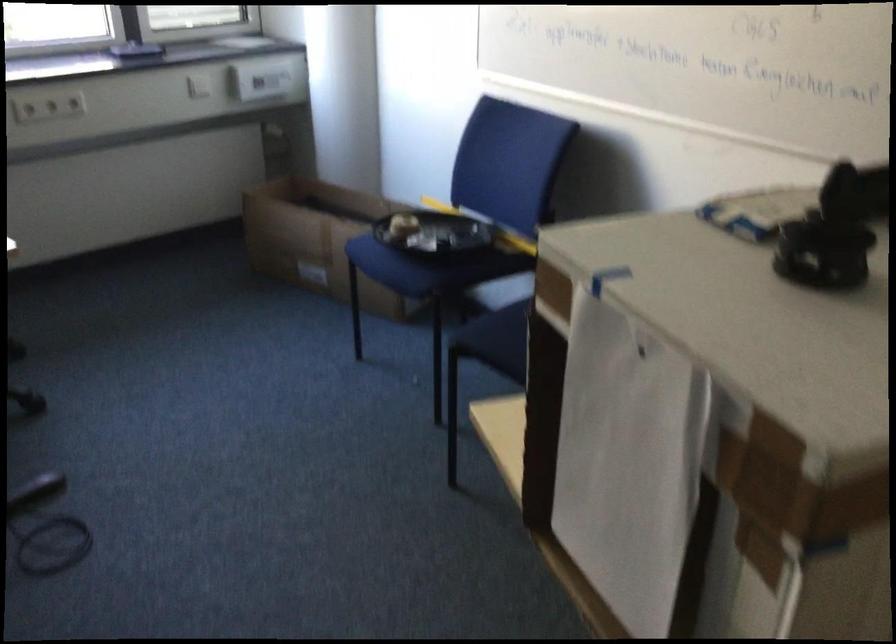
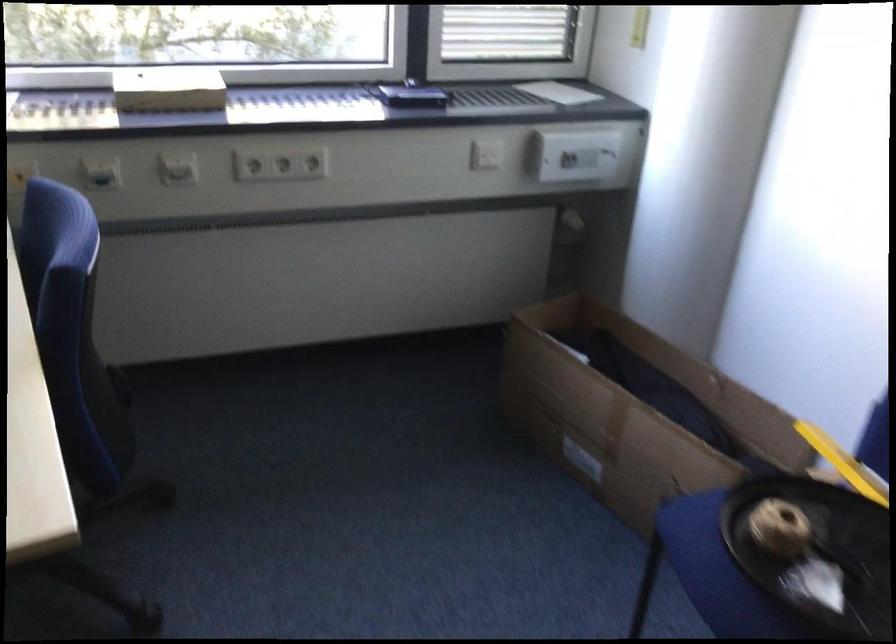
What movement of the cameraman would produce the second image?

The cameraman walked toward left, forward.